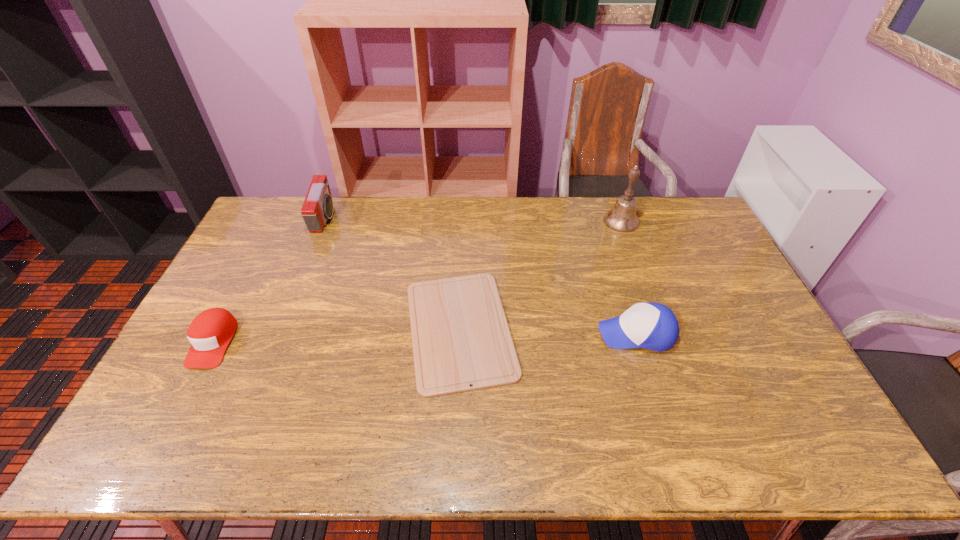
Locate an element on the screen. the tallest object is located at coordinates (622, 217).

Locate an element on the screen. the fourth shortest object is located at coordinates (317, 208).

Locate an element on the screen. The height and width of the screenshot is (540, 960). the fourth object from right to left is located at coordinates (317, 208).

Identify the location of the third tallest object. Image resolution: width=960 pixels, height=540 pixels. (653, 326).

You are a GUI agent. You are given a task and a screenshot of the screen. Output one action in this format:
    pyautogui.click(x=<x>, y=<y>)
    Task: Click on the right baseball cap
    
    Given the screenshot: What is the action you would take?
    pyautogui.click(x=653, y=326)

This screenshot has width=960, height=540. In order to click on the leftmost object in this screenshot , I will do `click(211, 331)`.

Where is `the second shortest object`? The width and height of the screenshot is (960, 540). the second shortest object is located at coordinates (211, 331).

You are a GUI agent. You are given a task and a screenshot of the screen. Output one action in this format:
    pyautogui.click(x=<x>, y=<y>)
    Task: Click on the chopping board
    The width and height of the screenshot is (960, 540).
    Given the screenshot: What is the action you would take?
    pyautogui.click(x=460, y=336)

At what (x,y) coordinates should I click in order to perform the action: click on the shortest object. Please return your answer as a coordinate pair (x, y). The width and height of the screenshot is (960, 540). Looking at the image, I should click on (460, 336).

At what (x,y) coordinates should I click in order to perform the action: click on vacant region located on the front of the tallest object. Please return your answer as a coordinate pair (x, y). This screenshot has height=540, width=960. Looking at the image, I should click on [636, 262].